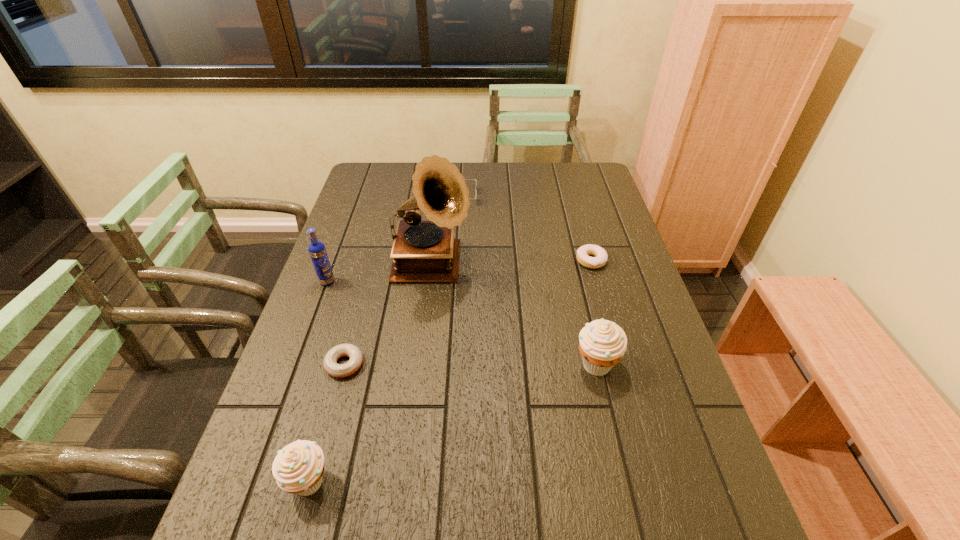
What are the coordinates of `object that is the nearest to the tallest object` in the screenshot? It's located at (317, 251).

Where is `the third closest object to the left doughnut`? the third closest object to the left doughnut is located at coordinates (317, 251).

Where is `free space in the image that satisfies the following two spatial constraints: 1. on the front-facing side of the farthest object; 2. on the right side of the third tallest object`? Image resolution: width=960 pixels, height=540 pixels. free space in the image that satisfies the following two spatial constraints: 1. on the front-facing side of the farthest object; 2. on the right side of the third tallest object is located at coordinates (450, 364).

Where is `vacant space that satisfies the following two spatial constraints: 1. on the front-facing side of the farther doughnut; 2. on the left side of the farthest object`? Image resolution: width=960 pixels, height=540 pixels. vacant space that satisfies the following two spatial constraints: 1. on the front-facing side of the farther doughnut; 2. on the left side of the farthest object is located at coordinates (457, 261).

You are a GUI agent. You are given a task and a screenshot of the screen. Output one action in this format:
    pyautogui.click(x=<x>, y=<y>)
    Task: Click on the vacant point that satisfies the following two spatial constraints: 1. on the front side of the right doughnut; 2. on the horn of the tallest object
    The image size is (960, 540).
    Given the screenshot: What is the action you would take?
    tap(592, 266)

Locate an element on the screen. This screenshot has width=960, height=540. free point that satisfies the following two spatial constraints: 1. on the back side of the third tallest object; 2. on the right side of the right doughnut is located at coordinates (572, 261).

At what (x,y) coordinates should I click in order to perform the action: click on vacant space that satisfies the following two spatial constraints: 1. on the back side of the fifth shortest object; 2. on the right side of the nearer doughnut. Please return your answer as a coordinate pair (x, y). The height and width of the screenshot is (540, 960). Looking at the image, I should click on (345, 364).